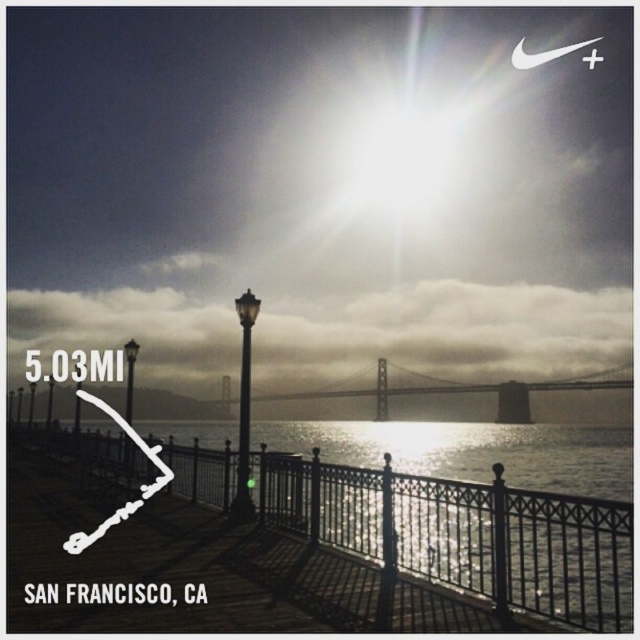
Question: Which is farther from the matte black lamp post at center?

Choices:
 (A) cloudy fog at center
 (B) black glass lamp post at center
 (C) black glass pole at center

Answer: (A)

Question: Which point is closer to the camera?

Choices:
 (A) cloudy fog at center
 (B) black glass lamp post at center
 (C) metallic black railing at lower center

Answer: (C)

Question: Where is matte black lamp post at center located in relation to black glass lamp post at center in the image?

Choices:
 (A) left
 (B) right

Answer: (B)

Question: Can you confirm if metallic black railing at lower center is positioned above matte black lamp post at center?

Choices:
 (A) yes
 (B) no

Answer: (B)

Question: Is metallic black railing at lower center bigger than matte black lamp post at center?

Choices:
 (A) yes
 (B) no

Answer: (A)

Question: Which of the following is the farthest from the observer?

Choices:
 (A) (422, 380)
 (B) (52, 433)
 (C) (248, 444)

Answer: (A)